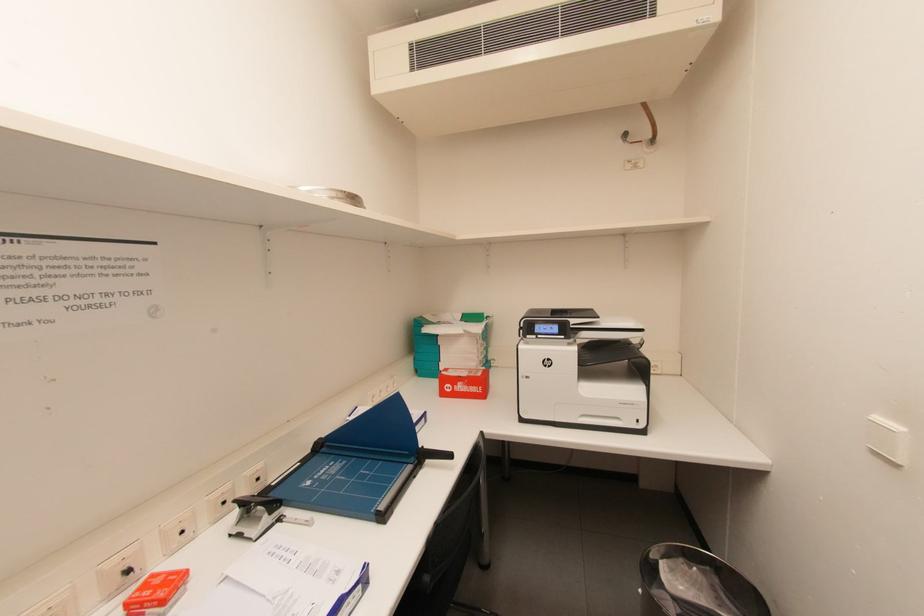
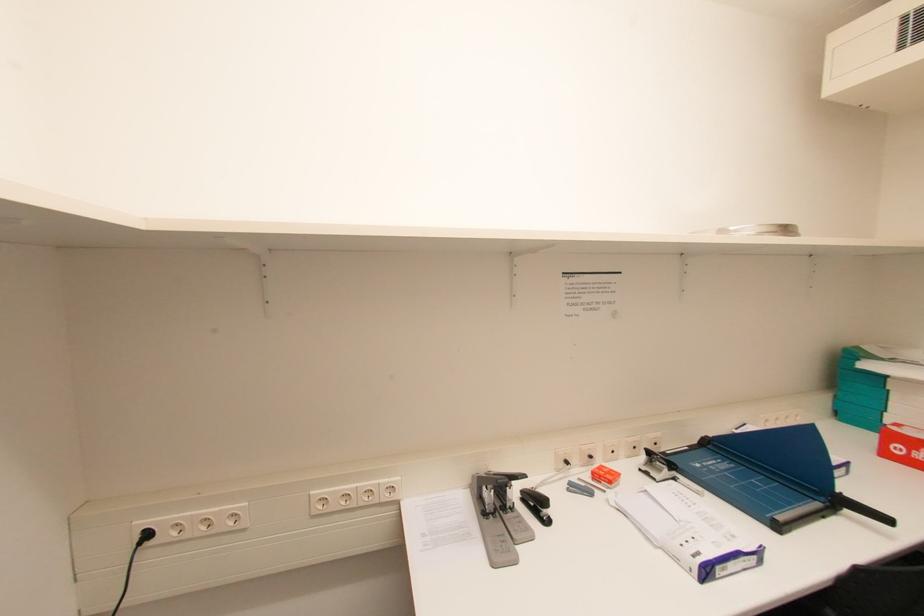
Question: How did the camera likely rotate?

Choices:
 (A) Left
 (B) Right
 (C) Up
 (D) Down

Answer: (A)